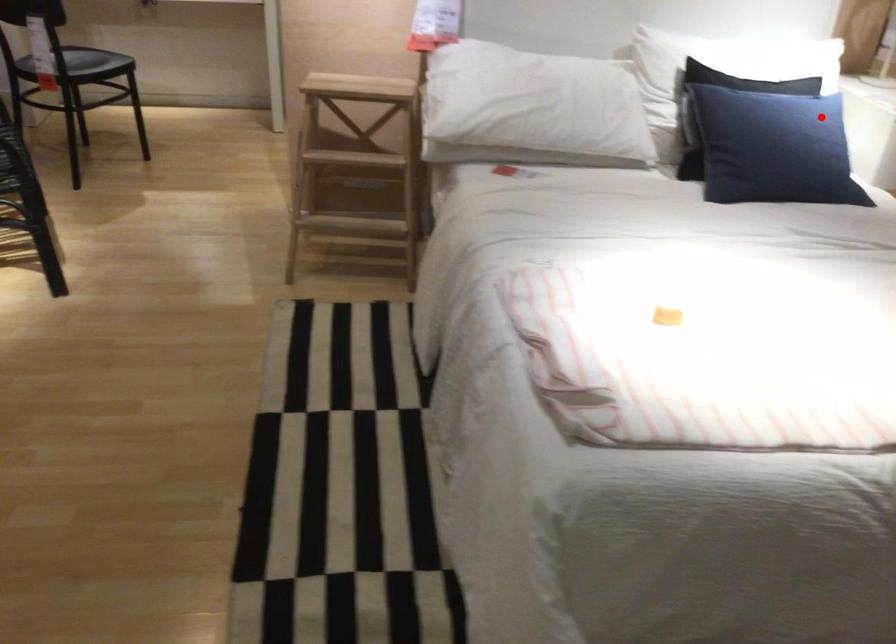
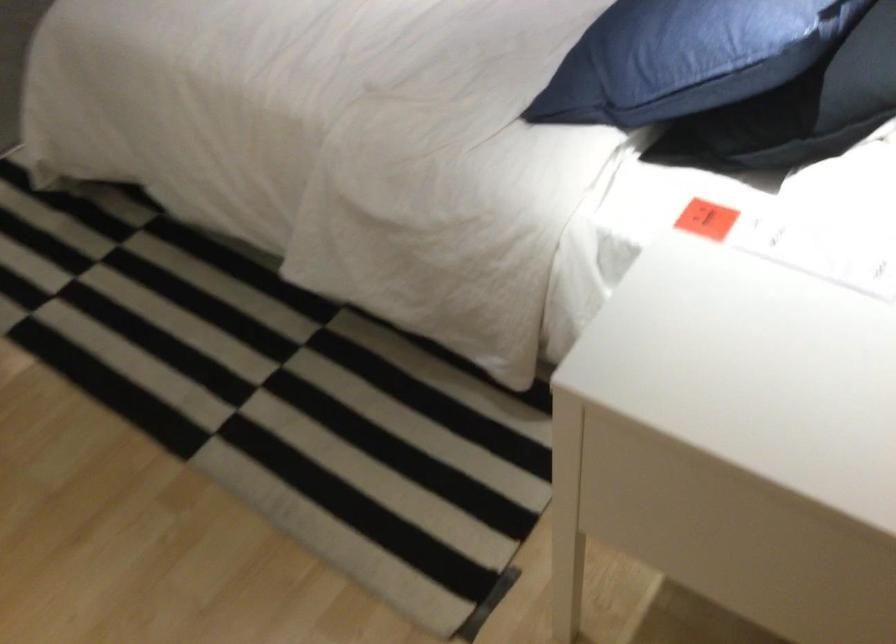
The point at the highlighted location is marked in the first image. Where is the corresponding point in the second image?

(808, 108)